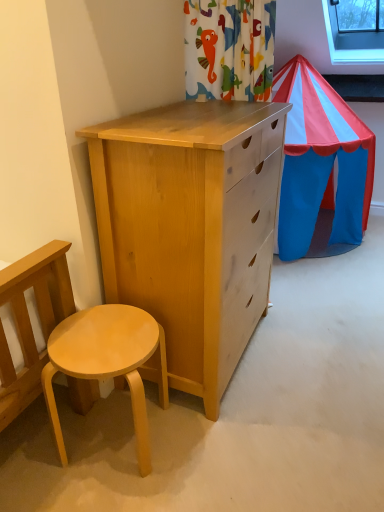
Question: In the image, is transparent glass window at upper right positioned in front of or behind light wood stool at lower left?

Choices:
 (A) behind
 (B) front

Answer: (A)

Question: Is point (344, 53) positioned closer to the camera than point (87, 327)?

Choices:
 (A) farther
 (B) closer

Answer: (A)

Question: Looking at their shapes, would you say transparent glass window at upper right is wider or thinner than light wood stool at lower left?

Choices:
 (A) wide
 (B) thin

Answer: (A)

Question: From a real-world perspective, is light wood stool at lower left physically located above or below transparent glass window at upper right?

Choices:
 (A) above
 (B) below

Answer: (B)

Question: Is point (117, 310) positioned closer to the camera than point (334, 59)?

Choices:
 (A) farther
 (B) closer

Answer: (B)

Question: From their relative heights in the image, would you say light wood stool at lower left is taller or shorter than transparent glass window at upper right?

Choices:
 (A) tall
 (B) short

Answer: (A)

Question: Considering the positions of light wood stool at lower left and transparent glass window at upper right in the image, is light wood stool at lower left bigger or smaller than transparent glass window at upper right?

Choices:
 (A) big
 (B) small

Answer: (B)